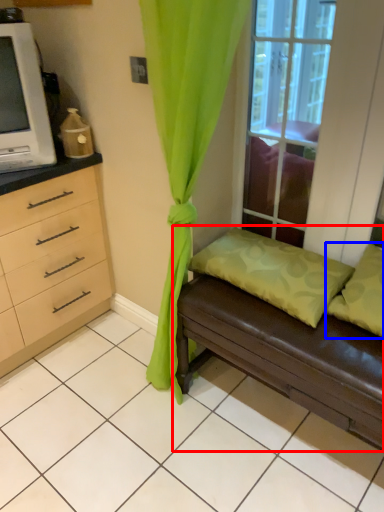
Question: Which of the following is the closest to the observer, studio couch (highlighted by a red box) or pillow (highlighted by a blue box)?

Choices:
 (A) studio couch
 (B) pillow

Answer: (A)